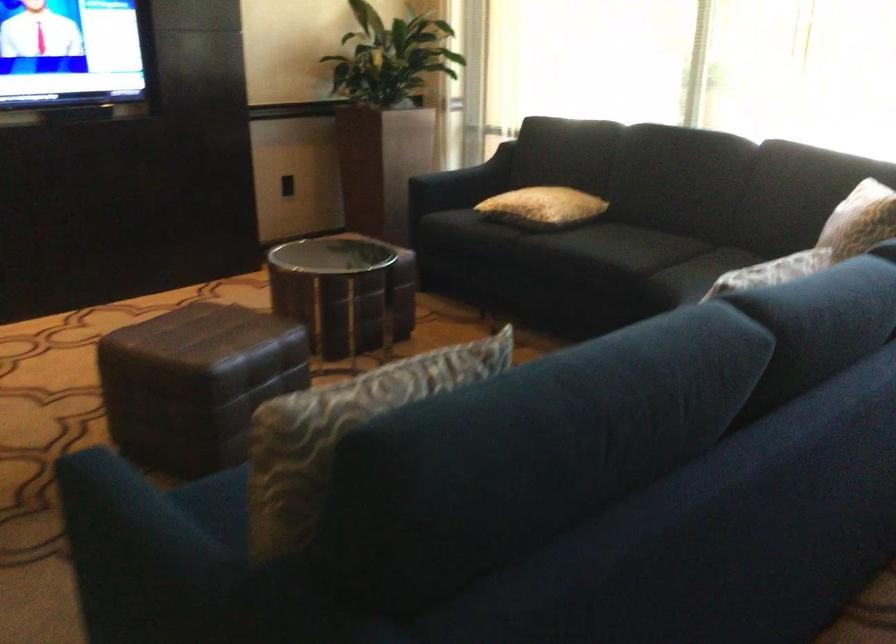
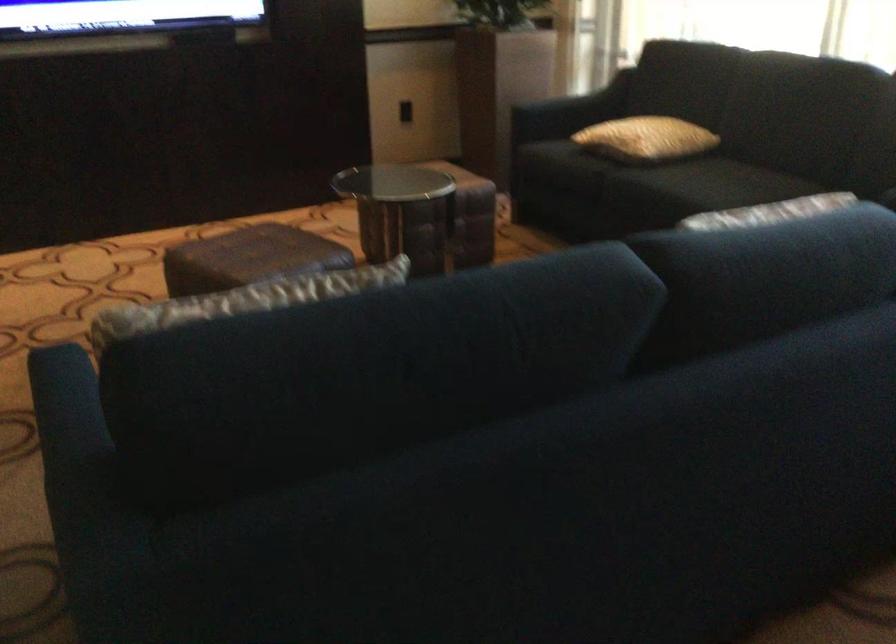
In the second image, find the point that corresponds to point 548,207 in the first image.

(645, 138)